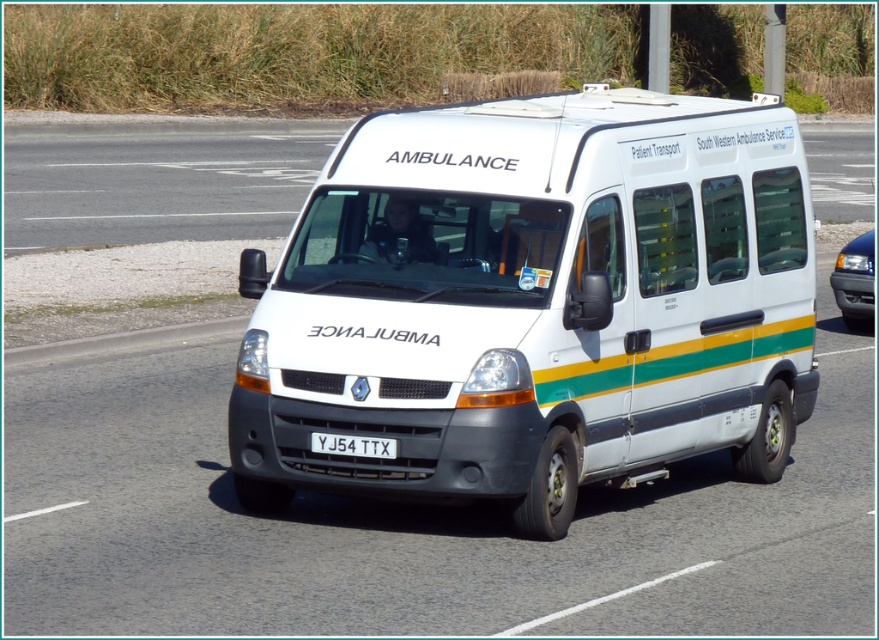
Question: Which object is positioned farthest from the metallic blue car at right?

Choices:
 (A) white matte ambulance at center
 (B) white plastic license plate at center

Answer: (B)

Question: Can you confirm if white matte ambulance at center is positioned to the right of metallic blue car at right?

Choices:
 (A) yes
 (B) no

Answer: (B)

Question: Which object is closer to the camera taking this photo?

Choices:
 (A) white plastic license plate at center
 (B) white matte ambulance at center
 (C) metallic blue car at right

Answer: (B)

Question: Among these points, which one is nearest to the camera?

Choices:
 (A) (383, 440)
 (B) (852, 289)

Answer: (A)

Question: Is metallic blue car at right to the right of white plastic license plate at center from the viewer's perspective?

Choices:
 (A) no
 (B) yes

Answer: (B)

Question: Can you confirm if white matte ambulance at center is positioned below white plastic license plate at center?

Choices:
 (A) no
 (B) yes

Answer: (A)